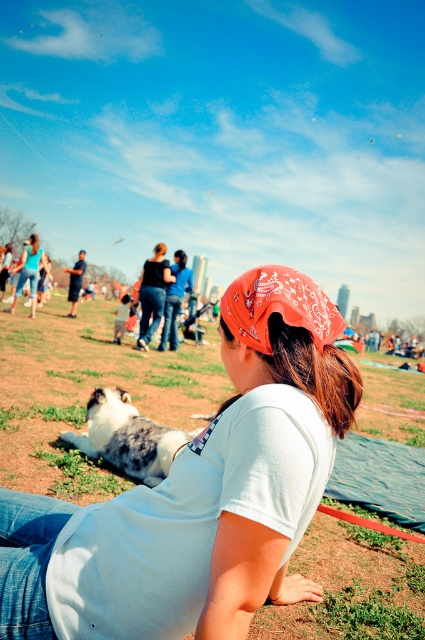
You are a photographer trying to capture a photo of the fluffy gray cat at lower left without the white cotton shirt at center blocking the view. Based on their sizes, is this possible?

The white cotton shirt at center is much taller than the fluffy gray cat at lower left, so it would block the view of the cat. You need to adjust your angle or move closer to the cat to avoid the shirt blocking the view.

You are a photographer trying to capture a clear shot of the brown silky hair at center and the fluffy gray cat at lower left. Which object should you focus on first to ensure both are in the frame without moving the camera?

You should focus on the brown silky hair at center first because it is behind the fluffy gray cat at lower left, so adjusting focus to the farther object first would help both be in the frame.